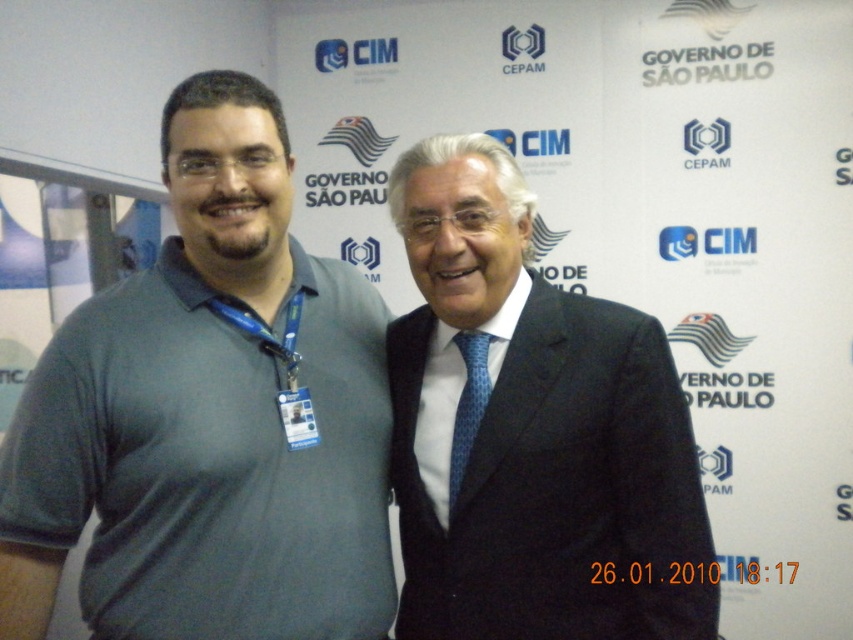
Is dark gray suit at center smaller than blue dotted tie at center?

No.

Between dark gray suit at center and blue dotted tie at center, which one appears on the right side from the viewer's perspective?

From the viewer's perspective, dark gray suit at center appears more on the right side.

The height and width of the screenshot is (640, 853). Describe the element at coordinates (531, 432) in the screenshot. I see `dark gray suit at center` at that location.

At what (x,y) coordinates should I click in order to perform the action: click on dark gray suit at center. Please return your answer as a coordinate pair (x, y). Looking at the image, I should click on (531, 432).

Does gray cotton polo shirt at left have a lesser height compared to blue dotted tie at center?

Incorrect, gray cotton polo shirt at left's height does not fall short of blue dotted tie at center's.

The image size is (853, 640). Find the location of `gray cotton polo shirt at left`. gray cotton polo shirt at left is located at coordinates 209,417.

The image size is (853, 640). I want to click on gray cotton polo shirt at left, so click(209, 417).

Locate an element on the screen. gray cotton polo shirt at left is located at coordinates (209, 417).

Can you confirm if gray cotton polo shirt at left is shorter than dark gray suit at center?

Incorrect, gray cotton polo shirt at left's height does not fall short of dark gray suit at center's.

Describe the element at coordinates (209, 417) in the screenshot. I see `gray cotton polo shirt at left` at that location.

The height and width of the screenshot is (640, 853). Find the location of `gray cotton polo shirt at left`. gray cotton polo shirt at left is located at coordinates (209, 417).